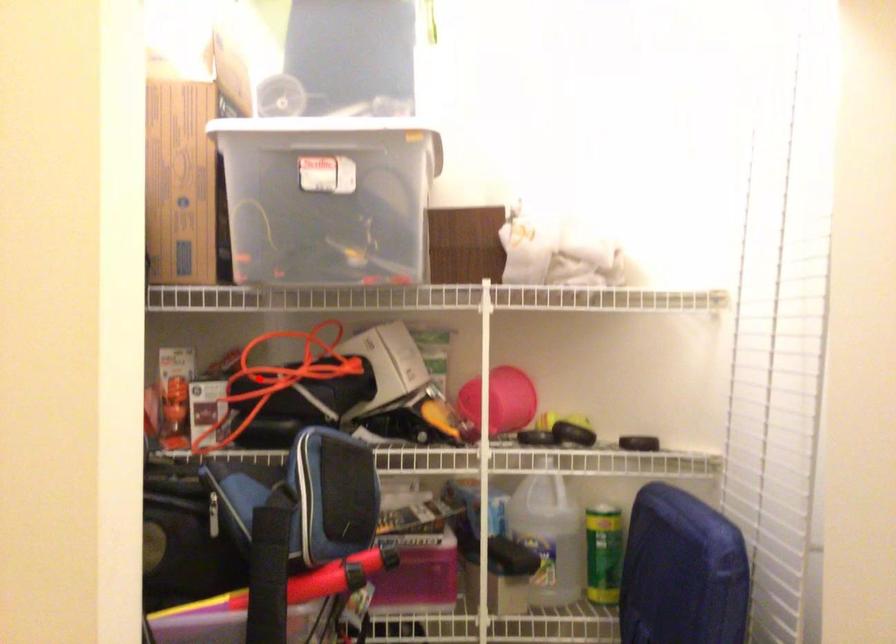
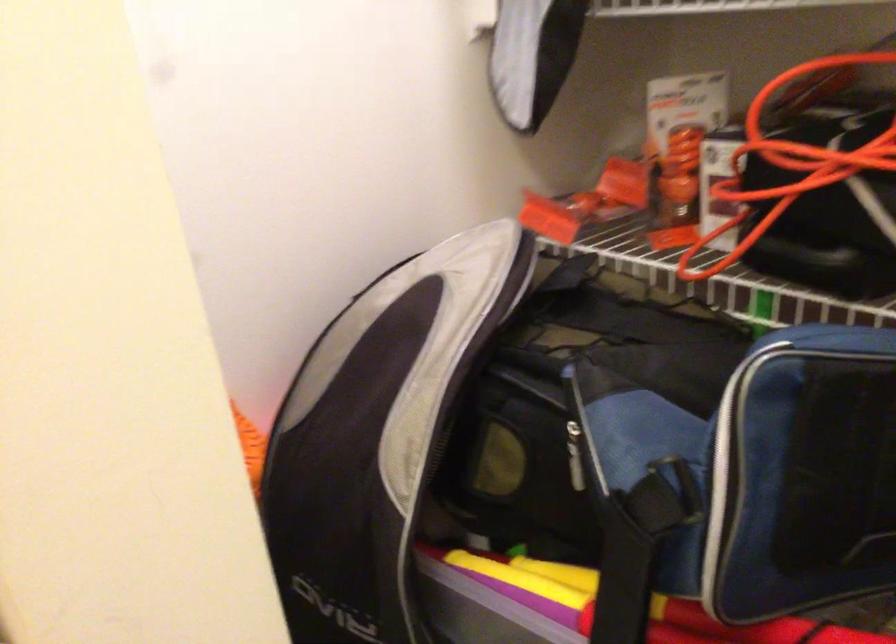
Find the pixel in the second image that matches the highlighted location in the first image.

(791, 163)